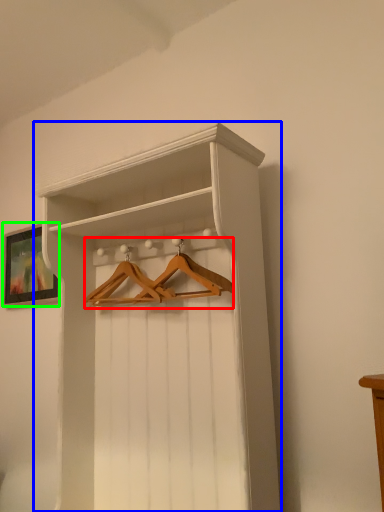
Question: Based on their relative distances, which object is nearer to hanger (highlighted by a red box)? Choose from shelf (highlighted by a blue box) and picture frame (highlighted by a green box).

Choices:
 (A) shelf
 (B) picture frame

Answer: (A)